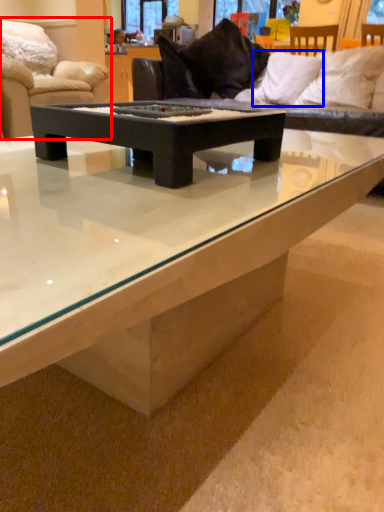
Question: Which object appears farthest to the camera in this image, studio couch (highlighted by a red box) or pillow (highlighted by a blue box)?

Choices:
 (A) studio couch
 (B) pillow

Answer: (A)